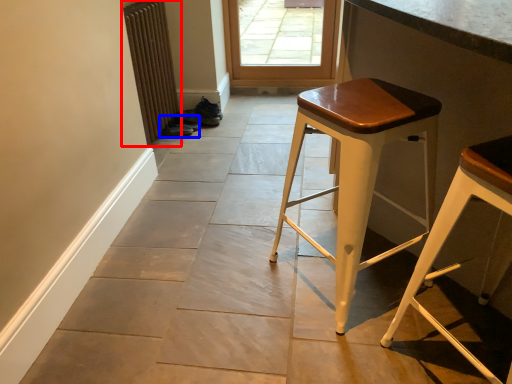
Question: Which of the following is the farthest to the observer, radiator (highlighted by a red box) or shoe (highlighted by a blue box)?

Choices:
 (A) radiator
 (B) shoe

Answer: (B)